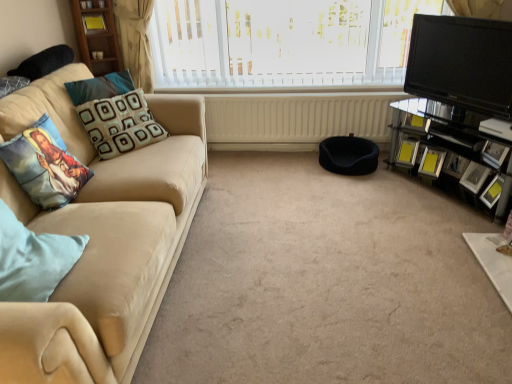
Locate an element on the screen. The width and height of the screenshot is (512, 384). vacant space situated on the left part of yellow paper at right, the first picture frame from the back is located at coordinates (391, 165).